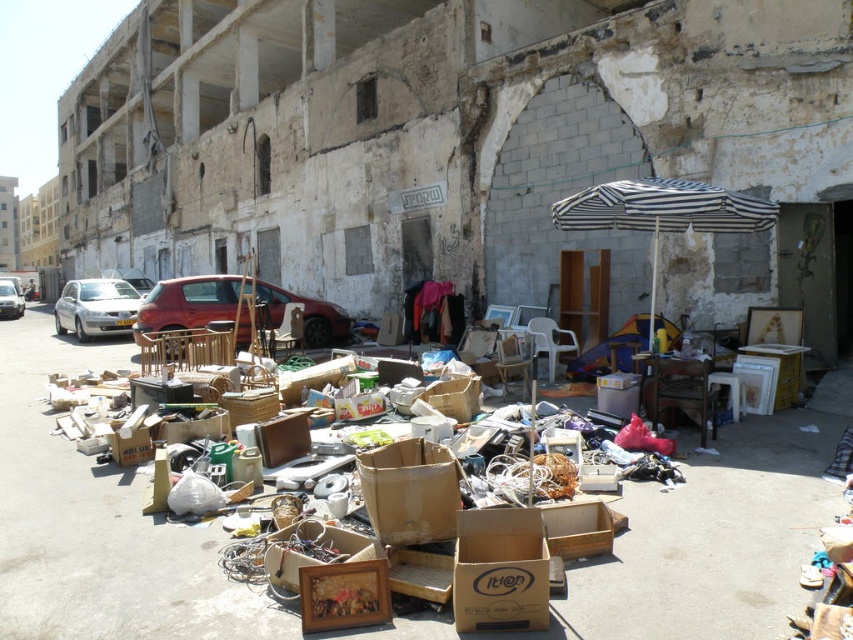
Question: Which object is farther from the camera taking this photo?

Choices:
 (A) silver metallic van at center
 (B) wooden chair at center
 (C) black and white striped umbrella at center
 (D) cardboard box at center

Answer: (A)

Question: Is brown cardboard boxes at center wider than cardboard box at center?

Choices:
 (A) yes
 (B) no

Answer: (A)

Question: Based on their relative distances, which object is nearer to the wooden chair at center?

Choices:
 (A) cardboard box at center
 (B) white matte car at left
 (C) metallic red car at center

Answer: (A)

Question: Considering the relative positions of cardboard box at center and silver metallic van at center in the image provided, where is cardboard box at center located with respect to silver metallic van at center?

Choices:
 (A) right
 (B) left

Answer: (A)

Question: Which of these objects is positioned closest to the brown cardboard box at center?

Choices:
 (A) cardboard box at center
 (B) white matte car at left
 (C) brown cardboard boxes at center

Answer: (A)

Question: From the image, what is the correct spatial relationship of brown cardboard boxes at center in relation to white matte car at left?

Choices:
 (A) left
 (B) right

Answer: (B)